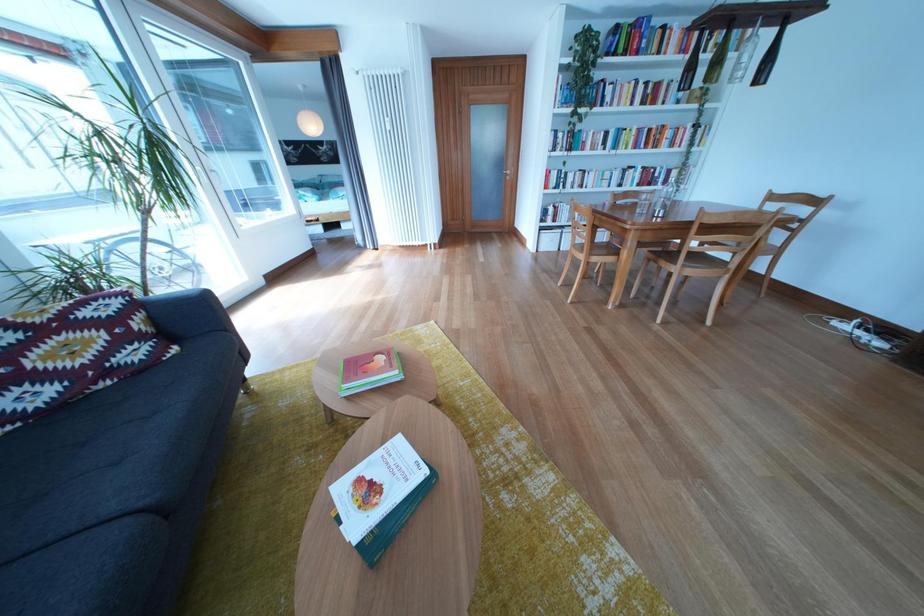
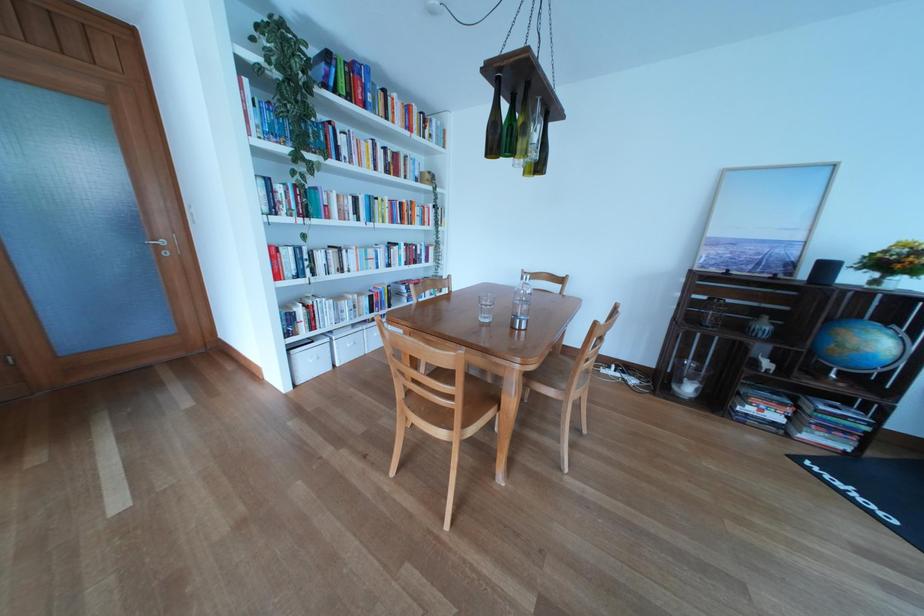
Find the pixel in the second image that matches point 521,177 in the first image.

(176, 248)